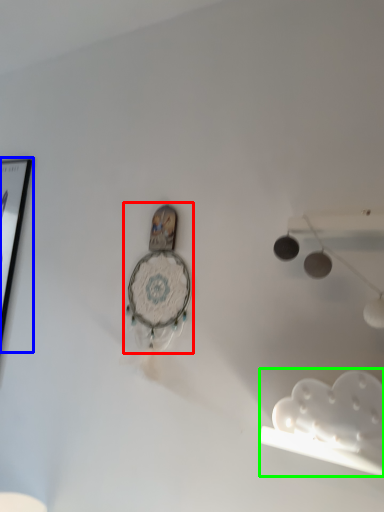
Question: Which object is positioned farthest from clock (highlighted by a red box)? Select from picture frame (highlighted by a blue box) and lamp (highlighted by a green box).

Choices:
 (A) picture frame
 (B) lamp

Answer: (A)